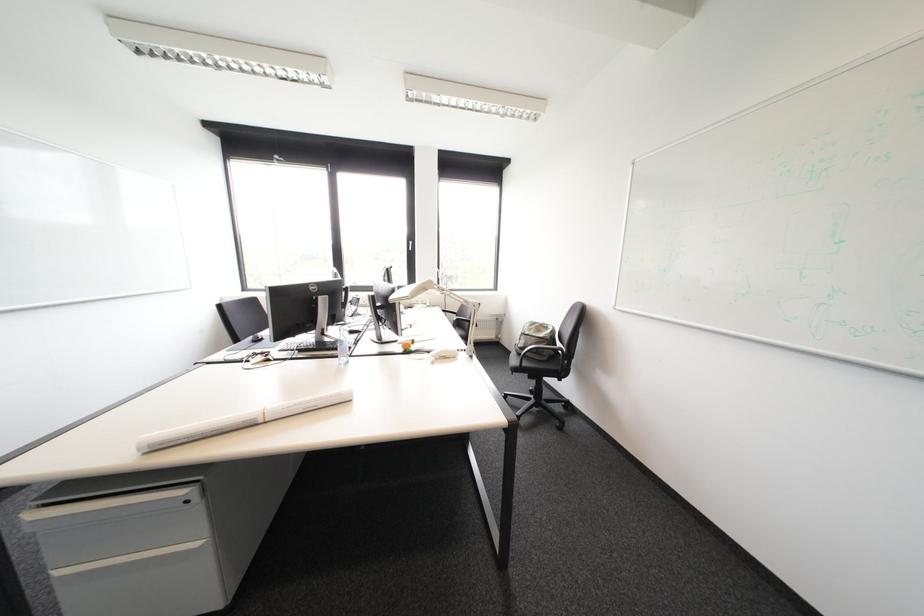
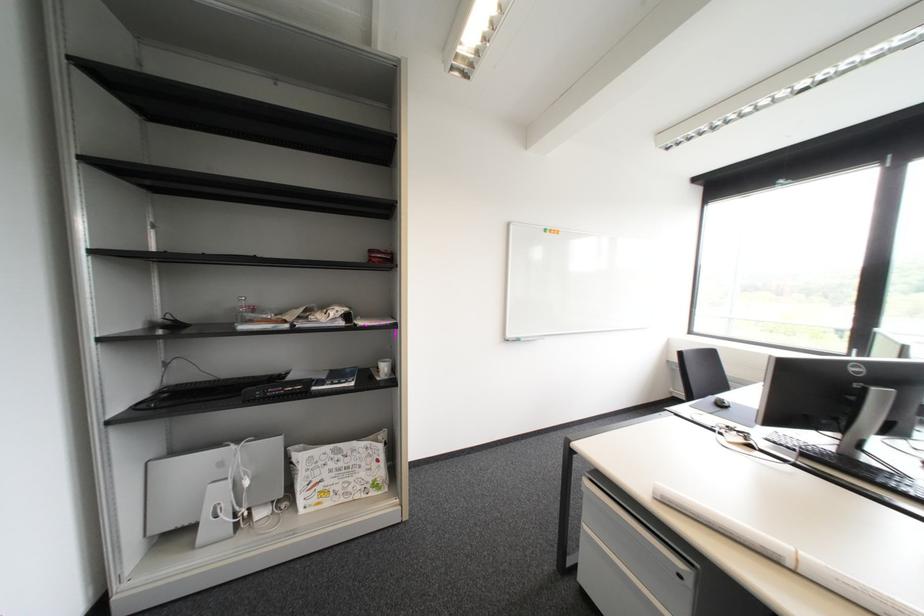
Find the pixel in the second image that matches [46,500] in the first image.

(600, 474)